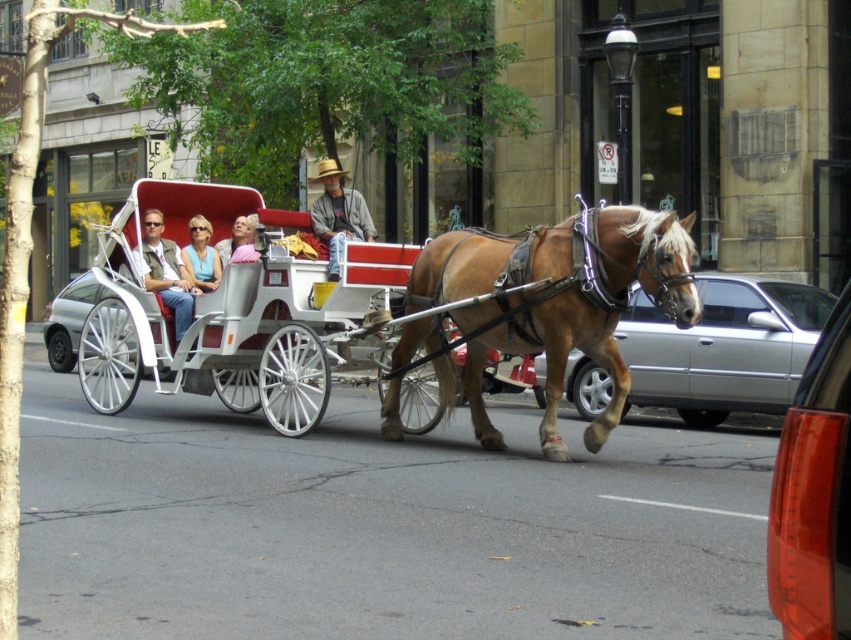
Which is more to the left, matte blue shirt at center or light blue denim shirt at center?

Positioned to the left is matte blue shirt at center.

Locate an element on the screen. The width and height of the screenshot is (851, 640). matte blue shirt at center is located at coordinates coord(201,256).

Identify the location of matte blue shirt at center. The height and width of the screenshot is (640, 851). (201, 256).

Which is more to the left, denim jacket at center or matte blue shirt at center?

matte blue shirt at center

Image resolution: width=851 pixels, height=640 pixels. What are the coordinates of `denim jacket at center` in the screenshot? It's located at (338, 212).

At what (x,y) coordinates should I click in order to perform the action: click on denim jacket at center. Please return your answer as a coordinate pair (x, y). Image resolution: width=851 pixels, height=640 pixels. Looking at the image, I should click on (338, 212).

Does white glossy carriage wheel at center lie in front of matte blue shirt at center?

Yes, white glossy carriage wheel at center is closer to the viewer.

How much distance is there between white glossy carriage wheel at center and matte blue shirt at center?

white glossy carriage wheel at center is 6.89 feet away from matte blue shirt at center.

What do you see at coordinates (69, 320) in the screenshot? Image resolution: width=851 pixels, height=640 pixels. I see `white glossy carriage wheel at center` at bounding box center [69, 320].

What are the coordinates of `white glossy carriage wheel at center` in the screenshot? It's located at (69, 320).